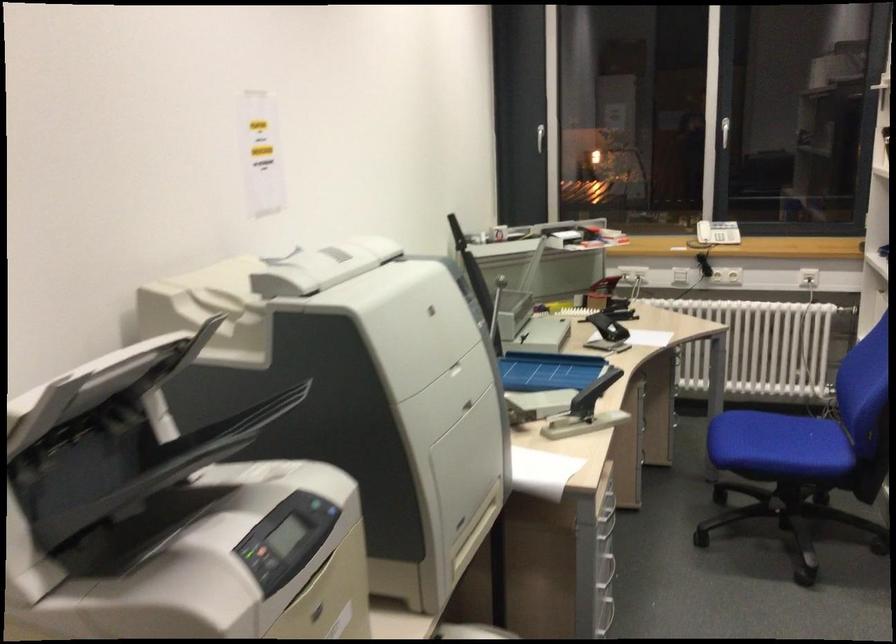
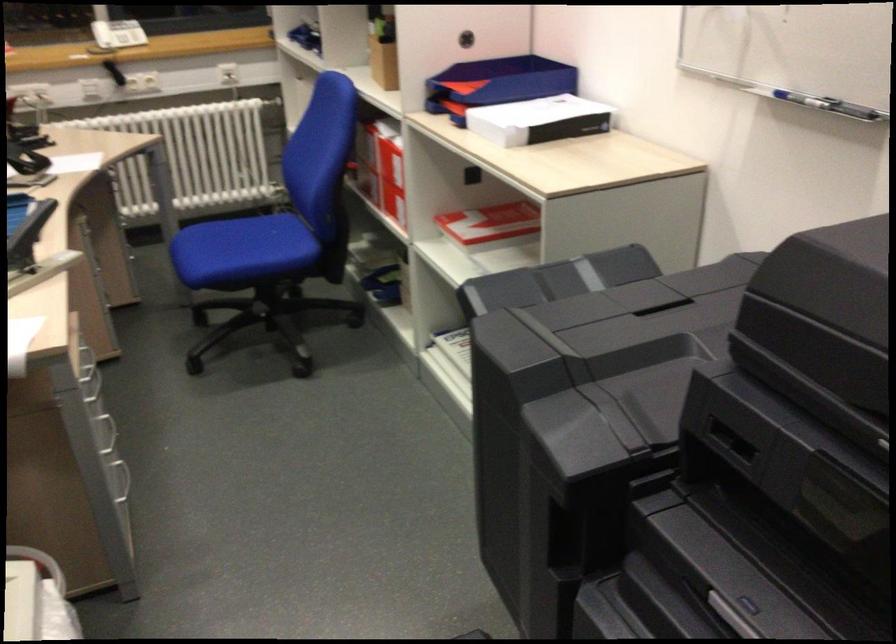
Locate, in the second image, the point that corresponds to [789,435] in the first image.

(254, 241)